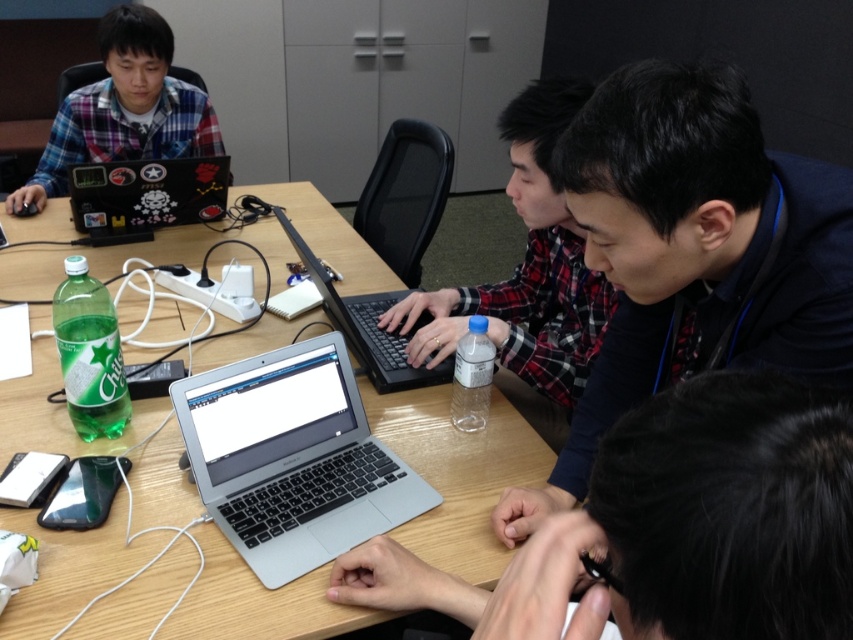
Between point (22, 209) and point (207, 161), which one is positioned behind?

The point (22, 209) is behind.

Does plaid fabric shirt at upper left have a greater height compared to sticker-covered plastic laptop at upper left?

Yes, plaid fabric shirt at upper left is taller than sticker-covered plastic laptop at upper left.

Find the location of `plaid fabric shirt at upper left`. plaid fabric shirt at upper left is located at coordinates (125, 109).

Identify the location of plaid fabric shirt at upper left. (125, 109).

Between sticker-covered plastic laptop at upper left and silver/black plastic laptop at center, which one has less height?

Standing shorter between the two is sticker-covered plastic laptop at upper left.

Is sticker-covered plastic laptop at upper left shorter than silver/black plastic laptop at center?

Correct, sticker-covered plastic laptop at upper left is not as tall as silver/black plastic laptop at center.

Describe the element at coordinates (144, 196) in the screenshot. This screenshot has height=640, width=853. I see `sticker-covered plastic laptop at upper left` at that location.

You are a GUI agent. You are given a task and a screenshot of the screen. Output one action in this format:
    pyautogui.click(x=<x>, y=<y>)
    Task: Click on the sticker-covered plastic laptop at upper left
    
    Given the screenshot: What is the action you would take?
    pyautogui.click(x=144, y=196)

Does silver metallic laptop at center lie in front of plaid fabric shirt at center?

Yes, it is.

Is point (422, 499) closer to camera compared to point (556, 346)?

Yes, it is in front of point (556, 346).

Locate an element on the screen. Image resolution: width=853 pixels, height=640 pixels. silver metallic laptop at center is located at coordinates (292, 458).